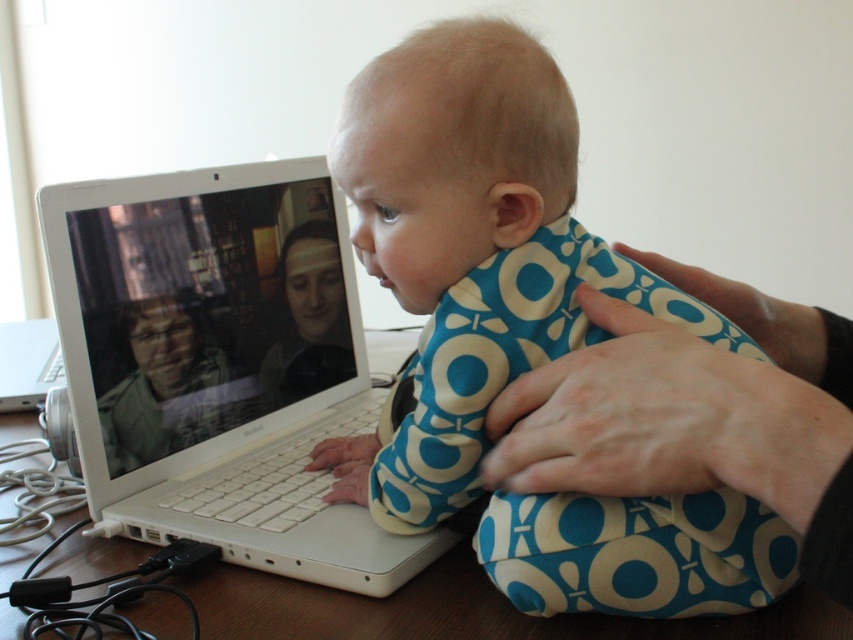
Question: Can you confirm if blue printed fabric at center is thinner than matte plastic face at center?

Choices:
 (A) no
 (B) yes

Answer: (A)

Question: Which point is farther from the camera taking this photo?

Choices:
 (A) (343, 371)
 (B) (288, 340)
 (C) (392, 529)

Answer: (A)

Question: Which object is positioned closest to the matte plastic face at center?

Choices:
 (A) green matte jacket at center
 (B) blue printed fabric at center
 (C) blue printed onesie at center
 (D) white plastic laptop at center

Answer: (D)

Question: Which point is farther from the camera taking this photo?

Choices:
 (A) (379, 509)
 (B) (364, 525)
 (C) (186, 440)

Answer: (C)

Question: Does blue printed onesie at center have a larger size compared to white plastic laptop at center?

Choices:
 (A) no
 (B) yes

Answer: (A)

Question: Is blue printed fabric at center to the right of matte plastic face at center from the viewer's perspective?

Choices:
 (A) no
 (B) yes

Answer: (B)